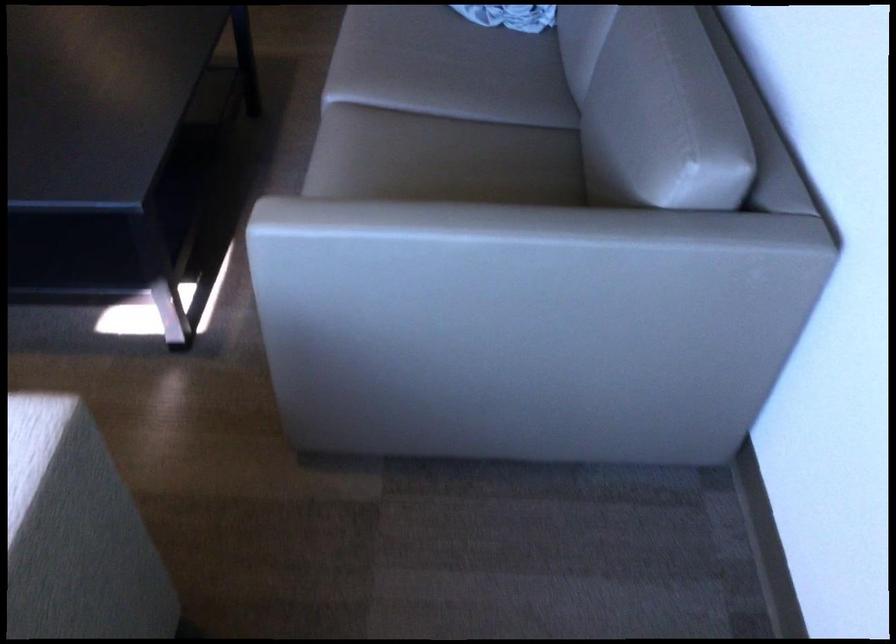
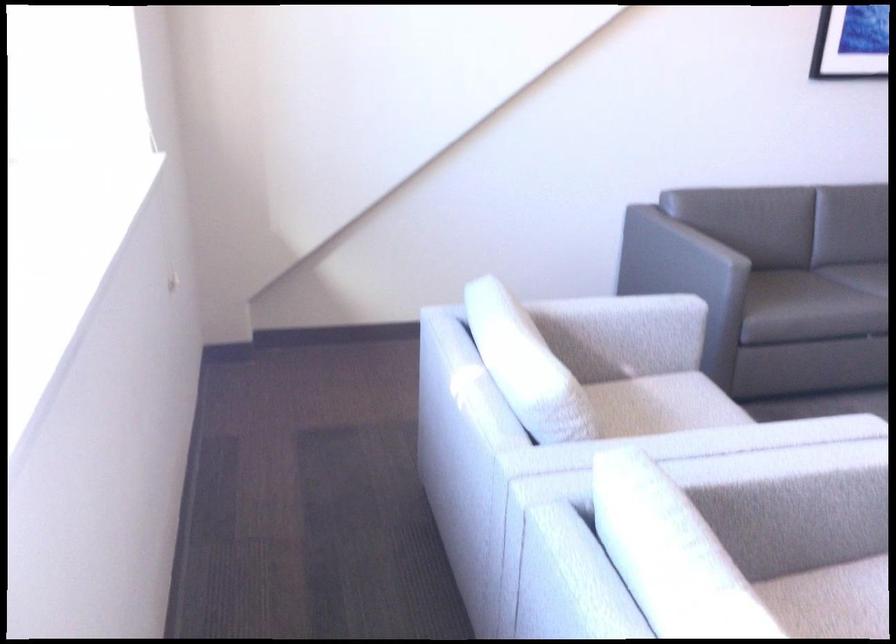
Question: The camera is either moving clockwise (left) or counter-clockwise (right) around the object. The first image is from the beginning of the video and the second image is from the end. Is the camera moving left or right when shooting the video?

Choices:
 (A) Left
 (B) Right

Answer: (B)